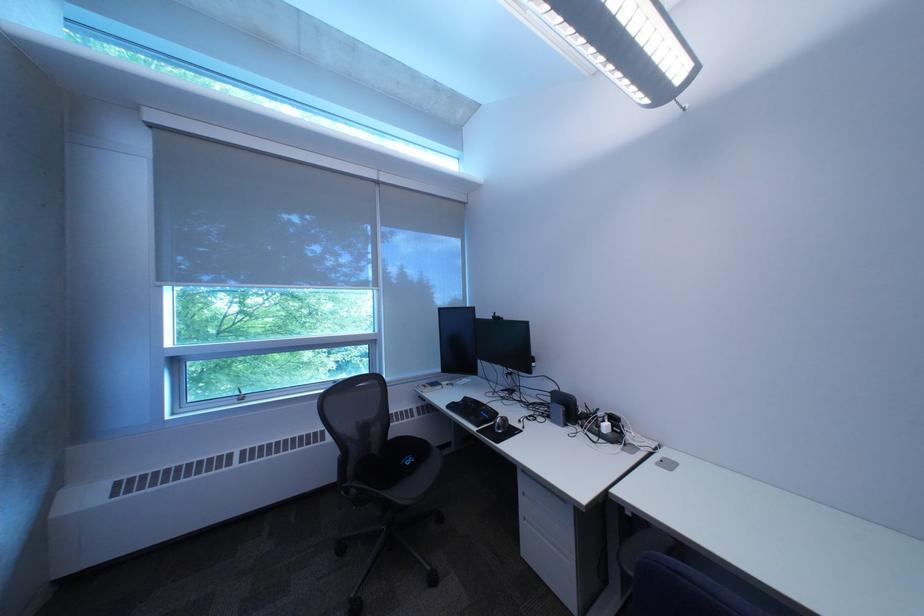
This screenshot has width=924, height=616. In order to click on black chair sitting surface in this screenshot , I will do `click(392, 462)`.